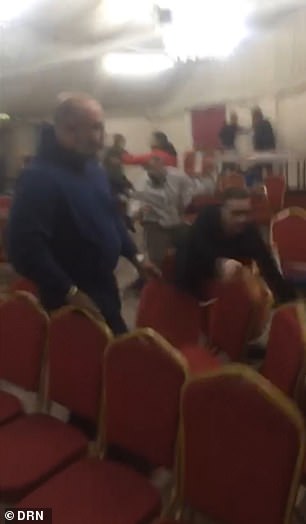
The height and width of the screenshot is (524, 306). Find the location of `floor`. floor is located at coordinates [126, 302].